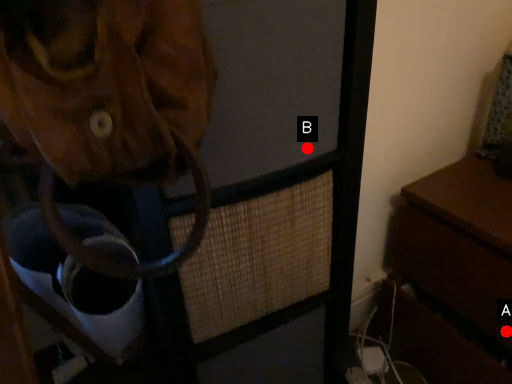
Question: Two points are circled on the image, labeled by A and B beside each circle. Which point is closer to the camera?

Choices:
 (A) A is closer
 (B) B is closer

Answer: (B)